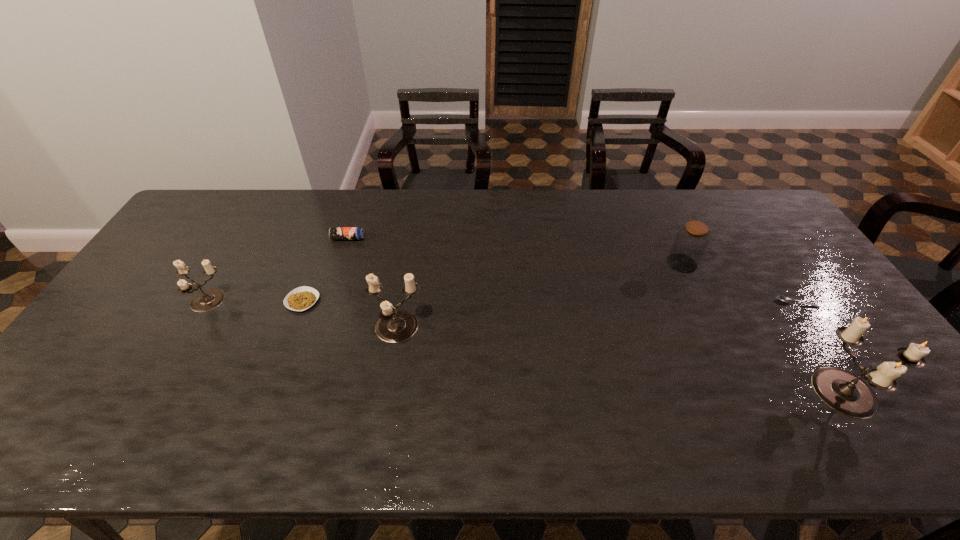
This screenshot has height=540, width=960. I want to click on candle holder present at the right edge, so click(844, 392).

Where is `soupspoon that is at the right edge`? The height and width of the screenshot is (540, 960). soupspoon that is at the right edge is located at coordinates point(782,298).

Identify the location of object that is at the near right corner. The height and width of the screenshot is (540, 960). (844, 392).

At what (x,y) coordinates should I click in order to perform the action: click on free space at the far edge of the desktop. Please return your answer as a coordinate pair (x, y). Image resolution: width=960 pixels, height=540 pixels. Looking at the image, I should click on (588, 210).

This screenshot has width=960, height=540. I want to click on vacant space at the near edge of the desktop, so click(651, 390).

Identify the location of free region at the right edge of the desktop. This screenshot has height=540, width=960. (828, 312).

Find the location of a particular element. This screenshot has width=960, height=540. free space between the leftmost candle holder and the third shortest object is located at coordinates (277, 270).

The height and width of the screenshot is (540, 960). What are the coordinates of `vacant area between the second shortest object and the sixth shortest object` in the screenshot? It's located at (349, 314).

I want to click on blank region between the legume and the second shortest candle holder, so click(x=349, y=314).

You are a GUI agent. You are given a task and a screenshot of the screen. Output one action in this format:
    pyautogui.click(x=<x>, y=<y>)
    Task: Click on the free area in between the second tallest object and the third object from right to left
    The width and height of the screenshot is (960, 540).
    Given the screenshot: What is the action you would take?
    pyautogui.click(x=539, y=296)